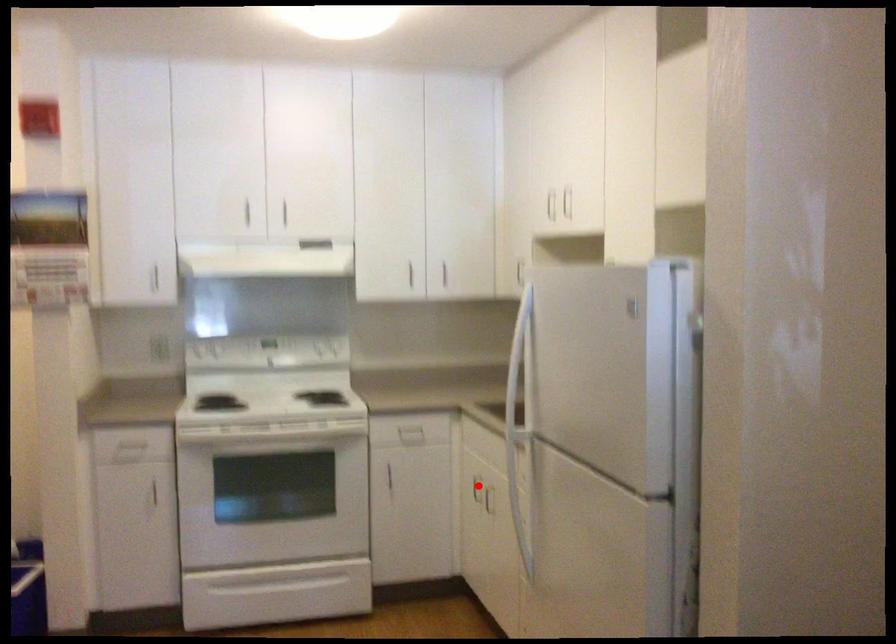
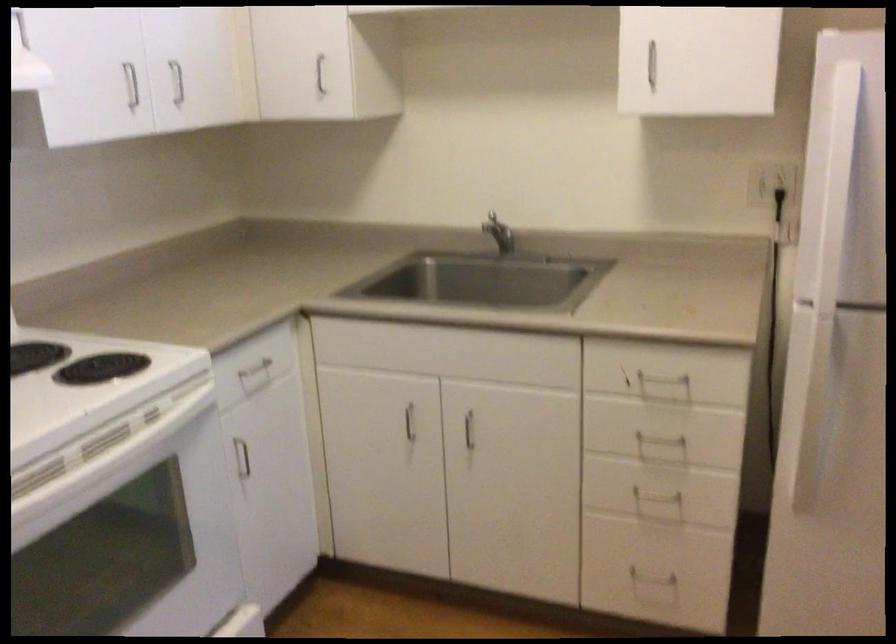
Locate, in the second image, the point that corresponds to the highlighted location in the first image.

(409, 422)